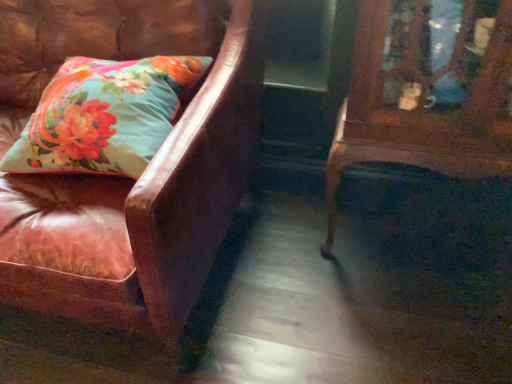
Where is `leather couch at left`? The image size is (512, 384). leather couch at left is located at coordinates [x=125, y=178].

Where is `floral fabric pillow at left`? The height and width of the screenshot is (384, 512). floral fabric pillow at left is located at coordinates (106, 115).

Is floral fabric pillow at left at the back of leather couch at left?

Yes, floral fabric pillow at left is at the back of leather couch at left.

Consider the image. Looking at their sizes, would you say leather couch at left is wider or thinner than floral fabric pillow at left?

Considering their sizes, leather couch at left looks broader than floral fabric pillow at left.

How far apart are leather couch at left and floral fabric pillow at left?

6.14 inches.

Which object is positioned more to the right, leather couch at left or floral fabric pillow at left?

floral fabric pillow at left.

Considering the positions of point (74, 162) and point (68, 44), is point (74, 162) closer or farther from the camera than point (68, 44)?

Clearly, point (74, 162) is closer to the camera than point (68, 44).

Is floral fabric pillow at left in contact with leather couch at left?

No, floral fabric pillow at left is not beside leather couch at left.

Does floral fabric pillow at left appear on the right side of leather couch at left?

Yes.

Is floral fabric pillow at left completely or partially outside of leather couch at left?

No, most part of floral fabric pillow at left lies within leather couch at left.

Is leather couch at left turned away from mahogany wood side table at right?

No, mahogany wood side table at right is not at the back of leather couch at left.

From a real-world perspective, does leather couch at left sit lower than mahogany wood side table at right?

Incorrect, from a real-world perspective, leather couch at left is higher than mahogany wood side table at right.

Is leather couch at left situated inside mahogany wood side table at right or outside?

leather couch at left is located beyond the bounds of mahogany wood side table at right.

Would you say floral fabric pillow at left is to the left or to the right of mahogany wood side table at right in the picture?

Based on their positions, floral fabric pillow at left is located to the left of mahogany wood side table at right.

Locate an element on the screen. furniture lying on the right of floral fabric pillow at left is located at coordinates (422, 107).

Is floral fabric pillow at left spatially inside mahogany wood side table at right, or outside of it?

floral fabric pillow at left is not enclosed by mahogany wood side table at right.

From the picture: Looking at the image, does mahogany wood side table at right seem bigger or smaller compared to leather couch at left?

mahogany wood side table at right is smaller than leather couch at left.

From the image's perspective, which is above, mahogany wood side table at right or leather couch at left?

leather couch at left.

Looking at this image, is mahogany wood side table at right wider or thinner than leather couch at left?

Clearly, mahogany wood side table at right has less width compared to leather couch at left.

Where is `chair on the left of the mahogany wood side table at right`? chair on the left of the mahogany wood side table at right is located at coordinates (125, 178).

From a real-world perspective, which object rests below the other?

In real-world perspective, mahogany wood side table at right is lower.

Where is `furniture on the right of the floral fabric pillow at left`? The width and height of the screenshot is (512, 384). furniture on the right of the floral fabric pillow at left is located at coordinates (422, 107).

Image resolution: width=512 pixels, height=384 pixels. Find the location of `chair below the floral fabric pillow at left (from the image's perspective)`. chair below the floral fabric pillow at left (from the image's perspective) is located at coordinates (125, 178).

The image size is (512, 384). I want to click on pillow on the right of leather couch at left, so click(x=106, y=115).

When comparing their distances from leather couch at left, does mahogany wood side table at right or floral fabric pillow at left seem further?

Among the two, mahogany wood side table at right is located further to leather couch at left.

Which object lies further to the anchor point floral fabric pillow at left, leather couch at left or mahogany wood side table at right?

The object further to floral fabric pillow at left is mahogany wood side table at right.

Based on the photo, when comparing their distances from floral fabric pillow at left, does mahogany wood side table at right or leather couch at left seem closer?

The object closer to floral fabric pillow at left is leather couch at left.

Considering their positions, is floral fabric pillow at left positioned further to leather couch at left than mahogany wood side table at right?

mahogany wood side table at right is positioned further to the anchor leather couch at left.

Considering their positions, is floral fabric pillow at left positioned further to mahogany wood side table at right than leather couch at left?

Based on the image, floral fabric pillow at left appears to be further to mahogany wood side table at right.

In the scene shown: When comparing their distances from mahogany wood side table at right, does leather couch at left or floral fabric pillow at left seem further?

floral fabric pillow at left is further to mahogany wood side table at right.

Where is `pillow between leather couch at left and mahogany wood side table at right from left to right`? The image size is (512, 384). pillow between leather couch at left and mahogany wood side table at right from left to right is located at coordinates (106, 115).